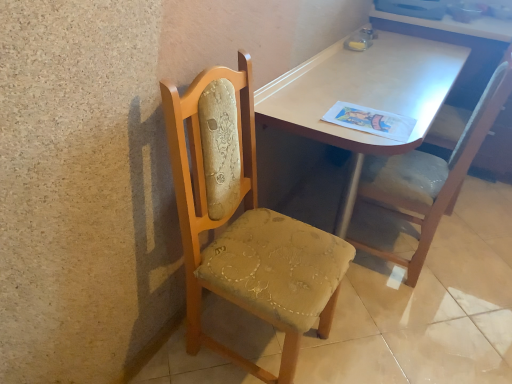
In order to face woodenchair at left, the 1th chair viewed from the left, should I rotate leftwards or rightwards?

Rotate right and turn 1.857 degrees.

The height and width of the screenshot is (384, 512). In order to click on woodenchair at left, the 1th chair viewed from the left in this screenshot , I will do point(244,222).

In order to face light brown wood table at center, should I rotate leftwards or rightwards?

A 14.905 degree turn to the right will do.

The width and height of the screenshot is (512, 384). Describe the element at coordinates (430, 175) in the screenshot. I see `velvet upholstered chair at right, the second chair when ordered from left to right` at that location.

Locate an element on the screen. Image resolution: width=512 pixels, height=384 pixels. woodenchair at left, the 1th chair viewed from the left is located at coordinates (244, 222).

Is woodenchair at left, which is the second chair from right to left, not near wooden chair at left?

woodenchair at left, which is the second chair from right to left, is actually quite close to wooden chair at left.

Which object is thinner, woodenchair at left, which is the second chair from right to left, or wooden chair at left?

woodenchair at left, which is the second chair from right to left.

Between woodenchair at left, which is the second chair from right to left, and wooden chair at left, which one has larger size?

Bigger between the two is wooden chair at left.

Is light brown wood table at center looking in the opposite direction of wooden chair at left?

light brown wood table at center does not have its back to wooden chair at left.

Considering the sizes of objects light brown wood table at center and wooden chair at left in the image provided, who is shorter, light brown wood table at center or wooden chair at left?

With less height is wooden chair at left.

Who is smaller, light brown wood table at center or wooden chair at left?

wooden chair at left is smaller.

Which is farther, [481,122] or [334,86]?

The point [334,86] is farther.

Would you say velvet upholstered chair at right, the first chair viewed from the right, is inside or outside light brown wood table at center?

velvet upholstered chair at right, the first chair viewed from the right, lies within the bounds of light brown wood table at center.

Relative to light brown wood table at center, is velvet upholstered chair at right, the first chair viewed from the right, in front or behind?

Visually, velvet upholstered chair at right, the first chair viewed from the right, is located behind light brown wood table at center.

Between velvet upholstered chair at right, the first chair viewed from the right, and light brown wood table at center, which one has smaller width?

velvet upholstered chair at right, the first chair viewed from the right, is thinner.

Considering the relative sizes of light brown wood table at center and velvet upholstered chair at right, the first chair viewed from the right, in the image provided, is light brown wood table at center smaller than velvet upholstered chair at right, the first chair viewed from the right,?

Actually, light brown wood table at center might be larger than velvet upholstered chair at right, the first chair viewed from the right.

Which is in front, point (384, 147) or point (418, 177)?

The point (384, 147) is closer to the camera.

In the scene shown: Does light brown wood table at center appear on the right side of velvet upholstered chair at right, the first chair viewed from the right?

No.

Is light brown wood table at center inside the boundaries of velvet upholstered chair at right, the first chair viewed from the right, or outside?

light brown wood table at center exists outside the volume of velvet upholstered chair at right, the first chair viewed from the right.

Is woodenchair at left, which is the second chair from right to left, positioned with its back to light brown wood table at center?

No.

Can you confirm if woodenchair at left, the 1th chair viewed from the left, is wider than light brown wood table at center?

No.

Considering the points (174, 127) and (309, 64), which point is behind, point (174, 127) or point (309, 64)?

The point (309, 64) is farther.

Is wooden chair at left oriented away from woodenchair at left, the 1th chair viewed from the left?

No.

In the image, is wooden chair at left positioned in front of or behind woodenchair at left, the 1th chair viewed from the left?

wooden chair at left is positioned farther from the viewer than woodenchair at left, the 1th chair viewed from the left.

Are wooden chair at left and woodenchair at left, the 1th chair viewed from the left, located far from each other?

Actually, wooden chair at left and woodenchair at left, the 1th chair viewed from the left, are a little close together.

From the picture: Based on their sizes in the image, would you say wooden chair at left is bigger or smaller than woodenchair at left, which is the second chair from right to left?

In the image, wooden chair at left appears to be larger than woodenchair at left, which is the second chair from right to left.

From the picture: Does velvet upholstered chair at right, the second chair when ordered from left to right, have a smaller size compared to woodenchair at left, the 1th chair viewed from the left?

Actually, velvet upholstered chair at right, the second chair when ordered from left to right, might be larger than woodenchair at left, the 1th chair viewed from the left.

Does velvet upholstered chair at right, the second chair when ordered from left to right, appear on the right side of woodenchair at left, which is the second chair from right to left?

Indeed, velvet upholstered chair at right, the second chair when ordered from left to right, is positioned on the right side of woodenchair at left, which is the second chair from right to left.

The image size is (512, 384). In order to click on concrete on the right of woodenchair at left, which is the second chair from right to left in this screenshot , I will do `click(428, 307)`.

The height and width of the screenshot is (384, 512). I want to click on table above the wooden chair at left (from a real-world perspective), so click(362, 95).

From the image, which object appears to be farther from light brown wood table at center, velvet upholstered chair at right, the second chair when ordered from left to right, or wooden chair at left?

wooden chair at left.

Considering their positions, is wooden chair at left positioned further to light brown wood table at center than velvet upholstered chair at right, the first chair viewed from the right?

Among the two, wooden chair at left is located further to light brown wood table at center.

Which object lies nearer to the anchor point velvet upholstered chair at right, the first chair viewed from the right, light brown wood table at center or wooden chair at left?

light brown wood table at center is closer to velvet upholstered chair at right, the first chair viewed from the right.

From the image, which object appears to be nearer to woodenchair at left, the 1th chair viewed from the left, velvet upholstered chair at right, the second chair when ordered from left to right, or light brown wood table at center?

light brown wood table at center lies closer to woodenchair at left, the 1th chair viewed from the left, than the other object.

Based on their spatial positions, is woodenchair at left, the 1th chair viewed from the left, or velvet upholstered chair at right, the first chair viewed from the right, closer to wooden chair at left?

velvet upholstered chair at right, the first chair viewed from the right, is closer to wooden chair at left.

Looking at this image, which object lies nearer to the anchor point woodenchair at left, the 1th chair viewed from the left, velvet upholstered chair at right, the first chair viewed from the right, or wooden chair at left?

wooden chair at left is closer to woodenchair at left, the 1th chair viewed from the left.

When comparing their distances from velvet upholstered chair at right, the first chair viewed from the right, does wooden chair at left or light brown wood table at center seem closer?

light brown wood table at center lies closer to velvet upholstered chair at right, the first chair viewed from the right, than the other object.

Which object lies further to the anchor point velvet upholstered chair at right, the second chair when ordered from left to right, wooden chair at left or woodenchair at left, the 1th chair viewed from the left?

woodenchair at left, the 1th chair viewed from the left, is further to velvet upholstered chair at right, the second chair when ordered from left to right.

Locate an element on the screen. This screenshot has height=384, width=512. concrete located between woodenchair at left, the 1th chair viewed from the left, and velvet upholstered chair at right, the first chair viewed from the right, in the left-right direction is located at coordinates (428, 307).

At what (x,y) coordinates should I click in order to perform the action: click on table between woodenchair at left, which is the second chair from right to left, and velvet upholstered chair at right, the first chair viewed from the right. Please return your answer as a coordinate pair (x, y). This screenshot has height=384, width=512. Looking at the image, I should click on (362, 95).

Find the location of a particular element. The height and width of the screenshot is (384, 512). table between woodenchair at left, which is the second chair from right to left, and wooden chair at left from left to right is located at coordinates (362, 95).